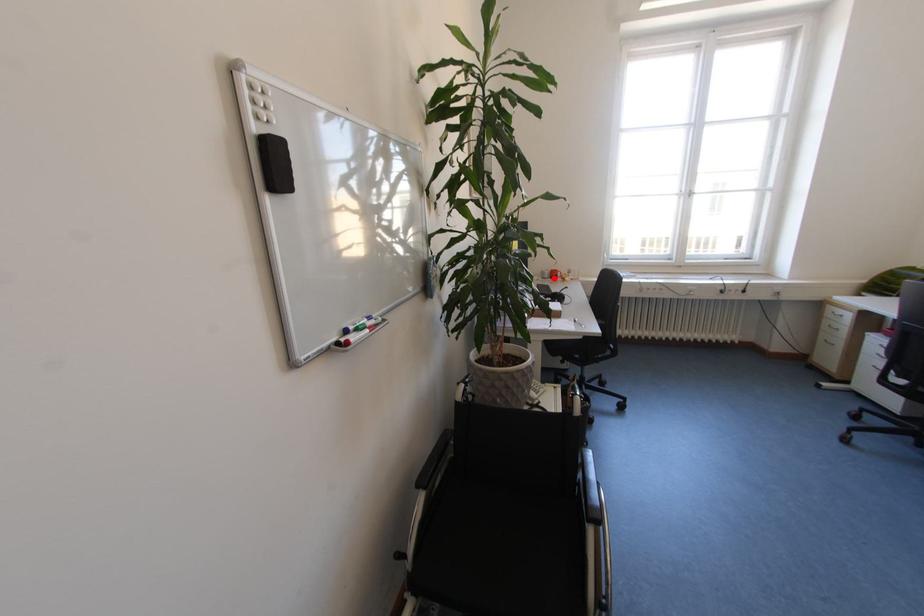
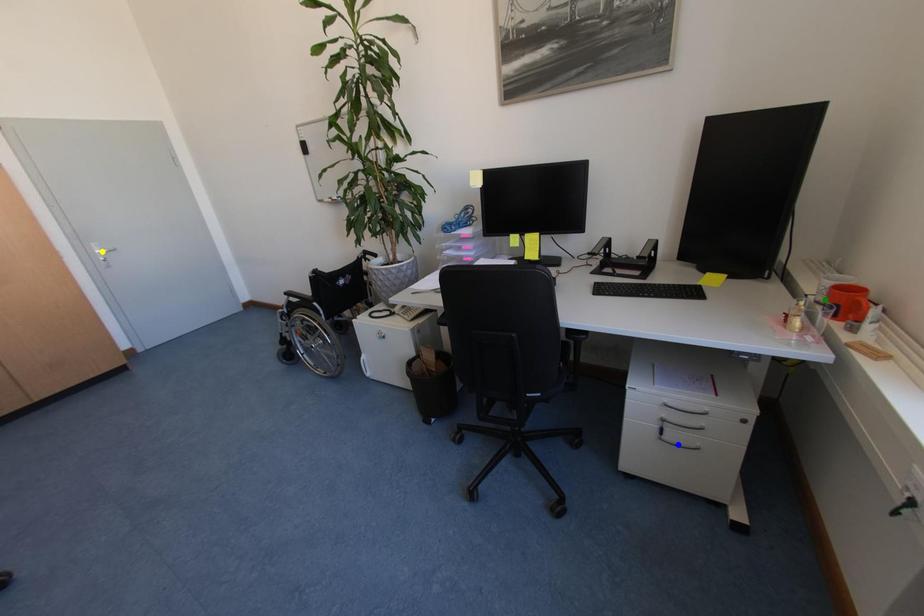
Question: I am providing you with two images of the same scene from different viewpoints. A red point is marked on the first image. You are given multiple points on the second image. Which point in image 2 is actually the same real-world point as the red point in image 1?

Choices:
 (A) yellow point
 (B) blue point
 (C) green point

Answer: (C)